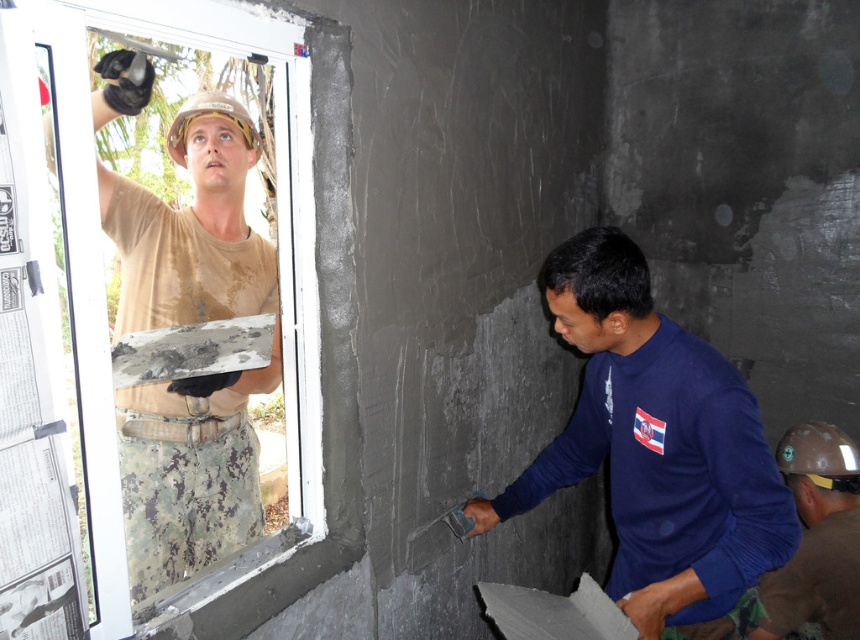
You are standing in front of the wall where the man is working. There are two points marked on the wall at coordinates point (292, 410) and point (708, 410). Which point is closer to you?

Point (292, 410) is closer to you because it is further to the camera than point (708, 410). Since you are standing in front of the wall, the point further to the camera would be nearer to your position.